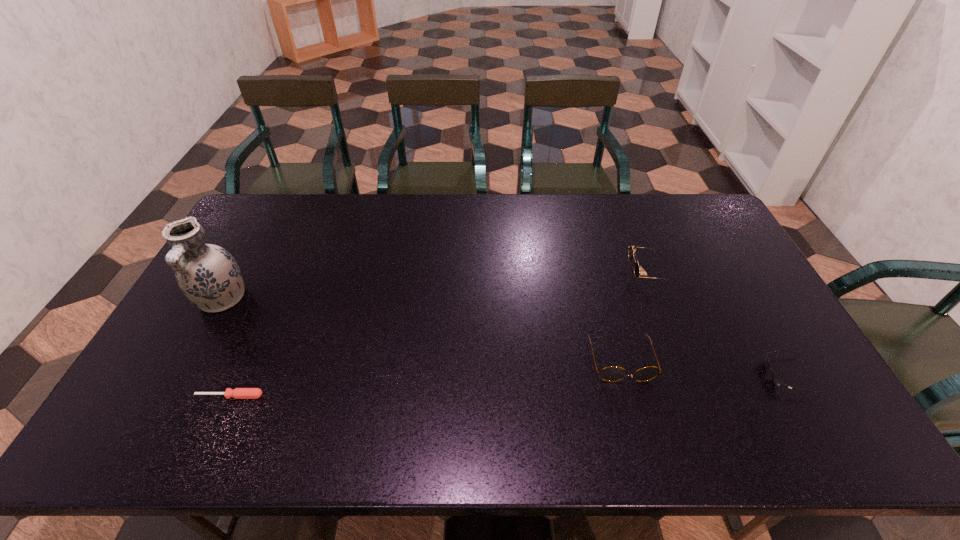
This screenshot has height=540, width=960. Identify the location of vacant space located on the front lenses of the farthest sunglasses. (515, 272).

In order to click on vacant space positioned 0.100m on the lenses of the third object from right to left in this screenshot , I will do `click(636, 420)`.

I want to click on vacant space located 0.320m on the front-facing side of the rightmost sunglasses, so click(x=642, y=375).

The width and height of the screenshot is (960, 540). What are the coordinates of `free region located on the front-facing side of the rightmost sunglasses` in the screenshot? It's located at (739, 375).

Where is `free space located on the front-facing side of the rightmost sunglasses`? Image resolution: width=960 pixels, height=540 pixels. free space located on the front-facing side of the rightmost sunglasses is located at coordinates (716, 375).

Locate an element on the screen. Image resolution: width=960 pixels, height=540 pixels. vacant area located on the right of the screwdriver is located at coordinates (396, 396).

What are the coordinates of `vase that is at the left edge` in the screenshot? It's located at (208, 275).

Find the location of a particular element. This screenshot has width=960, height=540. screwdriver positioned at the left edge is located at coordinates (238, 393).

I want to click on object that is at the right edge, so click(x=776, y=380).

Find the location of `vacant space at the far edge of the desktop`. vacant space at the far edge of the desktop is located at coordinates (475, 222).